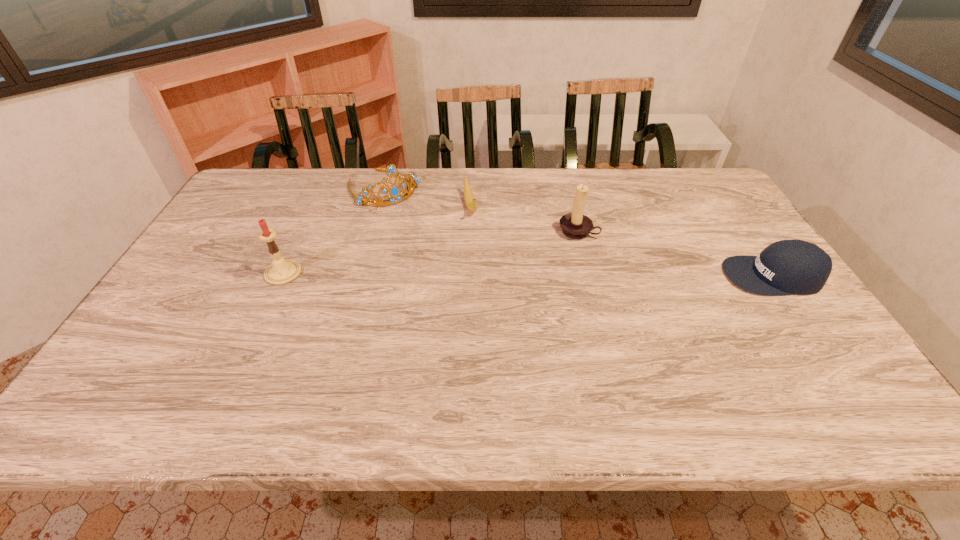
This screenshot has height=540, width=960. I want to click on candle, so click(280, 272).

This screenshot has width=960, height=540. In order to click on baseball cap in this screenshot , I will do `click(785, 267)`.

Where is `the fourth tallest object`? the fourth tallest object is located at coordinates (785, 267).

Identify the location of the fourth object from left to right. This screenshot has width=960, height=540. (575, 225).

The height and width of the screenshot is (540, 960). I want to click on the third object from left to right, so click(470, 202).

Where is `banana`? The image size is (960, 540). banana is located at coordinates (470, 202).

Image resolution: width=960 pixels, height=540 pixels. I want to click on the third tallest object, so click(x=394, y=191).

This screenshot has height=540, width=960. Find the location of `the fourth object from right to left`. the fourth object from right to left is located at coordinates (394, 191).

This screenshot has height=540, width=960. I want to click on vacant point located 0.340m on the back of the leftmost object, so click(x=320, y=194).

This screenshot has height=540, width=960. I want to click on free spot located on the front-facing side of the rightmost object, so click(x=673, y=276).